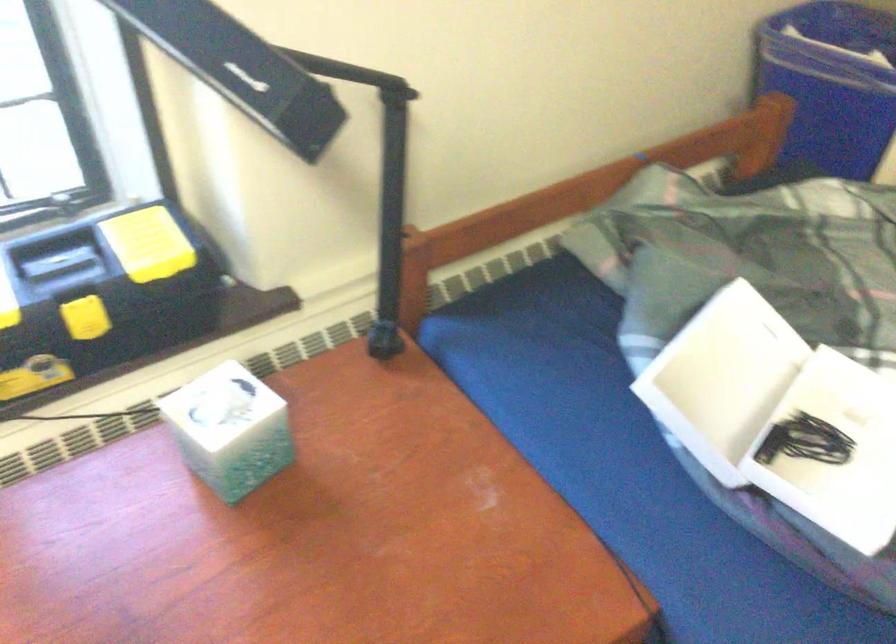
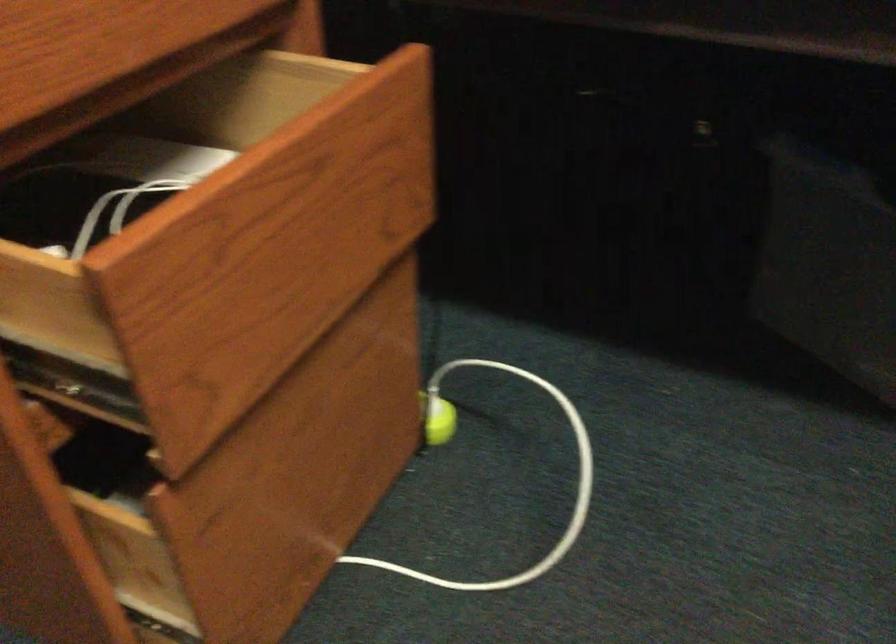
Question: What movement of the cameraman would produce the second image?

Choices:
 (A) Left
 (B) Right
 (C) Forward
 (D) Backward

Answer: (C)